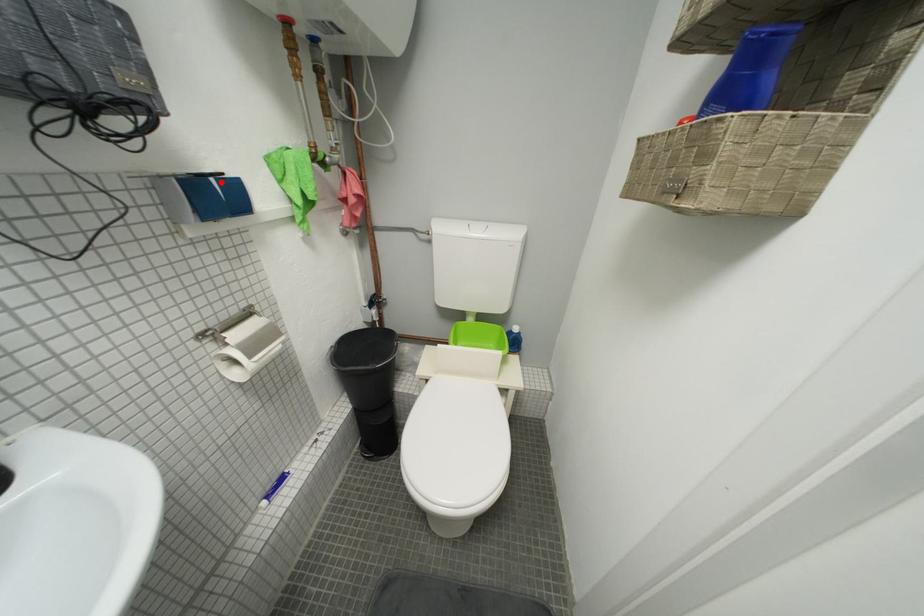
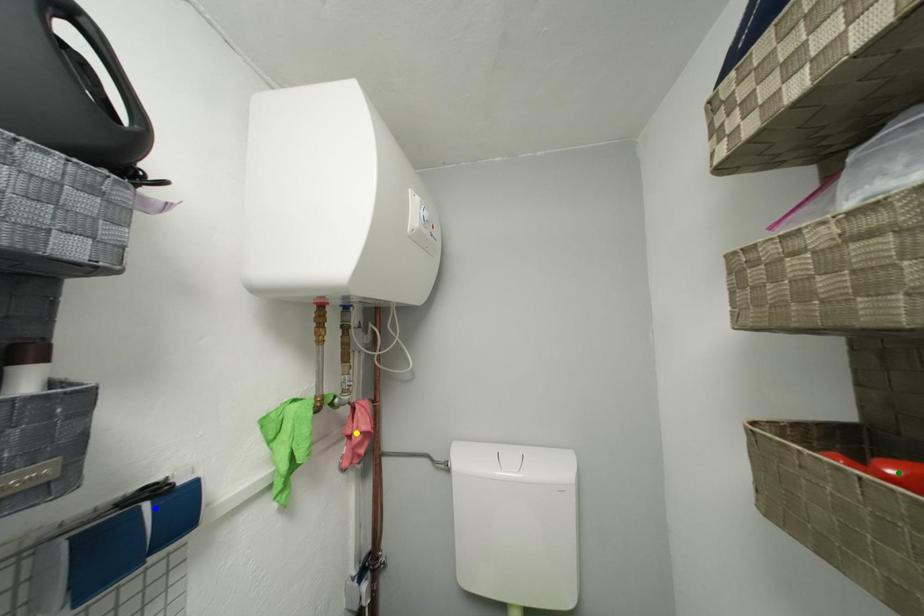
Question: I am providing you with two images of the same scene from different viewpoints. A red point is marked on the first image. You are given multiple points on the second image. In image 2, which mark is for the same physical point as the one in image 1?

Choices:
 (A) yellow point
 (B) blue point
 (C) green point

Answer: (B)